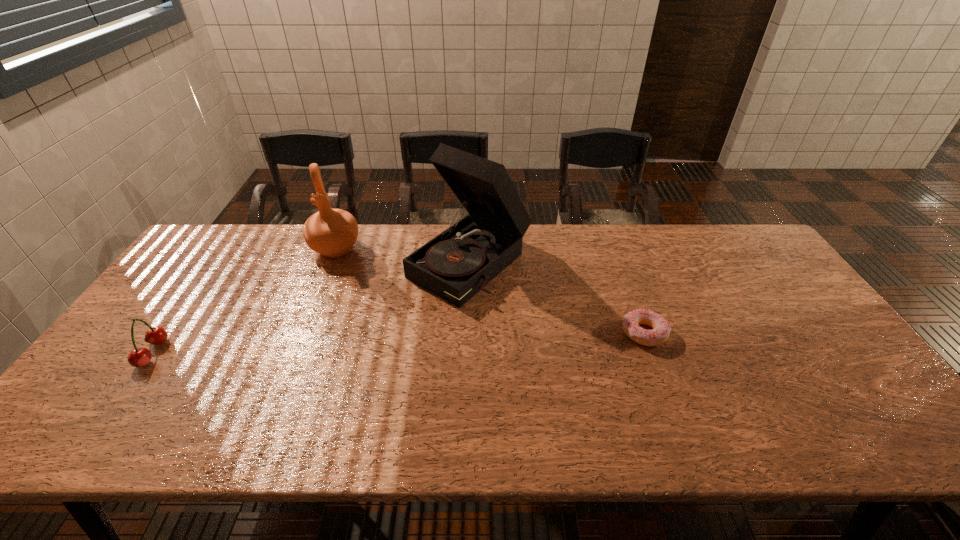
You are a GUI agent. You are given a task and a screenshot of the screen. Output one action in this format:
    pyautogui.click(x=<x>, y=<y>)
    Task: Click on the free space on the desktop that is between the cherry and the doughnut and is positioned on the front-facing side of the second object from right to left
    
    Given the screenshot: What is the action you would take?
    pyautogui.click(x=366, y=345)

Identify the location of free spot on the desktop that is between the leftmost object and the rightmost object and is positioned on the spout of the third shortest object. (336, 346).